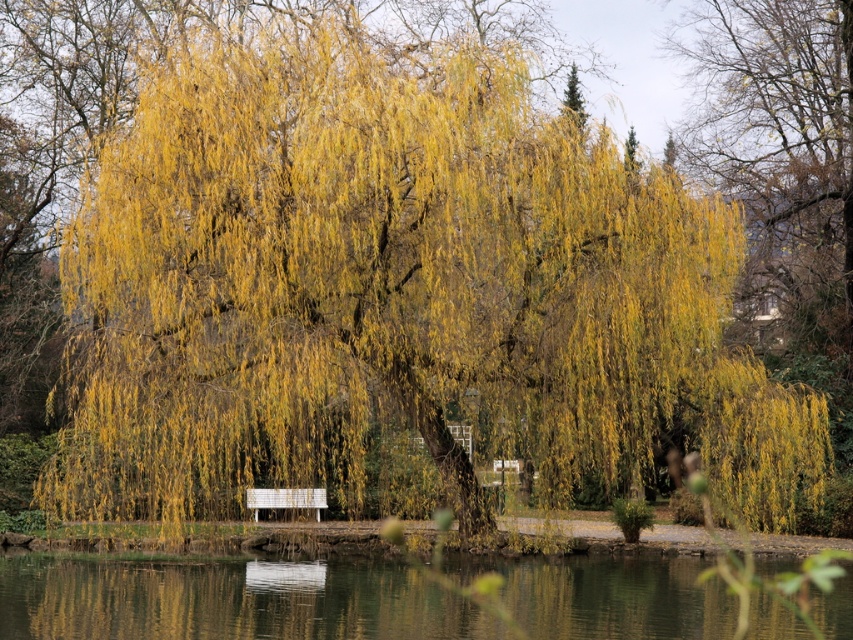
Is transparent water at lower center above white wooden bench at center?

No.

Is transparent water at lower center to the left of white wooden bench at center from the viewer's perspective?

Incorrect, transparent water at lower center is not on the left side of white wooden bench at center.

Does point (120, 614) come closer to viewer compared to point (316, 520)?

Yes, point (120, 614) is in front of point (316, 520).

Identify the location of transparent water at lower center. Image resolution: width=853 pixels, height=640 pixels. (228, 600).